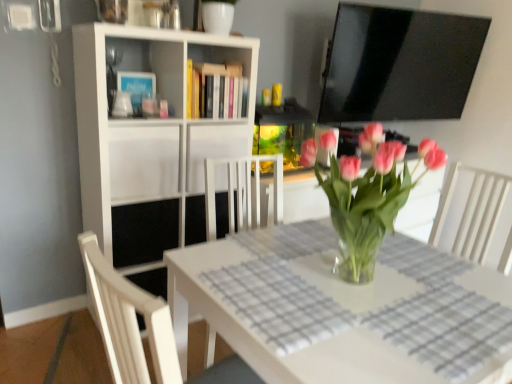
Question: Is hardcover books at upper center positioned far away from clear glass table at center?

Choices:
 (A) no
 (B) yes

Answer: (A)

Question: Is hardcover books at upper center beside clear glass table at center?

Choices:
 (A) yes
 (B) no

Answer: (B)

Question: Does hardcover books at upper center have a larger size compared to clear glass table at center?

Choices:
 (A) no
 (B) yes

Answer: (A)

Question: Is hardcover books at upper center outside clear glass table at center?

Choices:
 (A) yes
 (B) no

Answer: (A)

Question: Considering the relative positions of hardcover books at upper center and clear glass table at center in the image provided, is hardcover books at upper center in front of clear glass table at center?

Choices:
 (A) yes
 (B) no

Answer: (B)

Question: From a real-world perspective, is hardcover books at upper center beneath clear glass table at center?

Choices:
 (A) yes
 (B) no

Answer: (B)

Question: Could white matte bookshelf at upper left, the first shelf in the top-to-bottom sequence, be considered to be inside white matte cabinet at center, which ranks as the 1th cabinet in right-to-left order?

Choices:
 (A) yes
 (B) no

Answer: (B)

Question: From a real-world perspective, is white matte cabinet at center, which ranks as the 1th cabinet in right-to-left order, over white matte bookshelf at upper left, the first shelf in the top-to-bottom sequence?

Choices:
 (A) yes
 (B) no

Answer: (A)

Question: Is white matte cabinet at center, marked as the second cabinet in a left-to-right arrangement, further to the viewer compared to white matte bookshelf at upper left, the first shelf in the top-to-bottom sequence?

Choices:
 (A) no
 (B) yes

Answer: (B)

Question: Is white matte cabinet at center, marked as the second cabinet in a left-to-right arrangement, facing away from white matte bookshelf at upper left, the first shelf in the top-to-bottom sequence?

Choices:
 (A) no
 (B) yes

Answer: (B)

Question: From a real-world perspective, is white matte cabinet at center, which ranks as the 1th cabinet in right-to-left order, under white matte bookshelf at upper left, which appears as the second shelf when ordered from the bottom?

Choices:
 (A) yes
 (B) no

Answer: (B)

Question: Considering the relative sizes of white matte cabinet at center, which ranks as the 1th cabinet in right-to-left order, and white matte bookshelf at upper left, which appears as the second shelf when ordered from the bottom, in the image provided, is white matte cabinet at center, which ranks as the 1th cabinet in right-to-left order, taller than white matte bookshelf at upper left, which appears as the second shelf when ordered from the bottom,?

Choices:
 (A) no
 (B) yes

Answer: (A)

Question: Can you confirm if black matte shelf at center, placed as the second shelf when sorted from top to bottom, is shorter than white matte cabinet at center, which ranks as the 1th cabinet in right-to-left order?

Choices:
 (A) no
 (B) yes

Answer: (B)